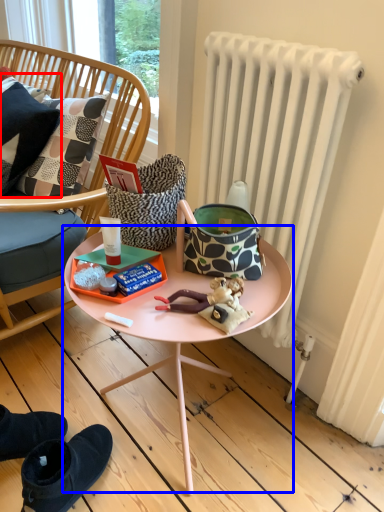
Question: Which object appears farthest to the camera in this image, pillow (highlighted by a red box) or table (highlighted by a blue box)?

Choices:
 (A) pillow
 (B) table

Answer: (A)